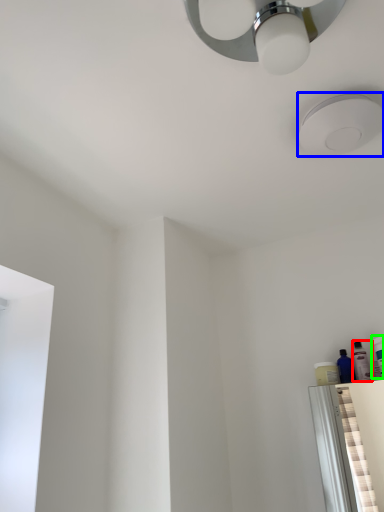
Question: Based on their relative distances, which object is farther from toiletry (highlighted by a red box)? Choose from droplight (highlighted by a blue box) and toiletry (highlighted by a green box).

Choices:
 (A) droplight
 (B) toiletry

Answer: (A)